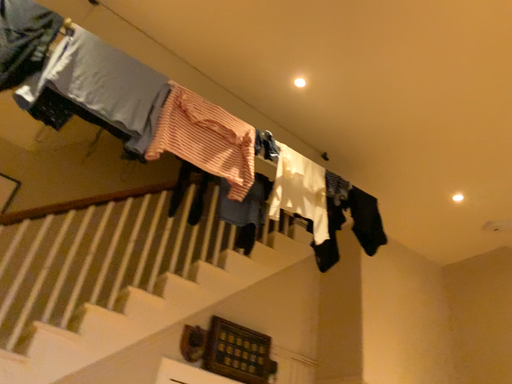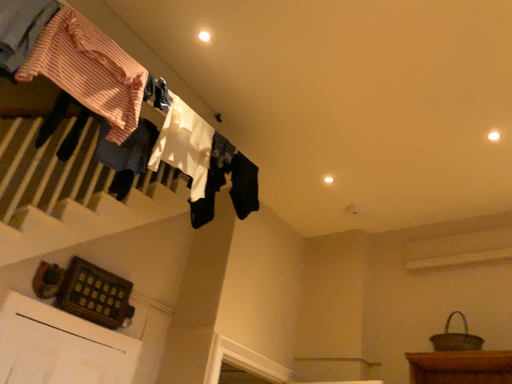
Question: Which way did the camera rotate in the video?

Choices:
 (A) rotated downward
 (B) rotated upward

Answer: (A)